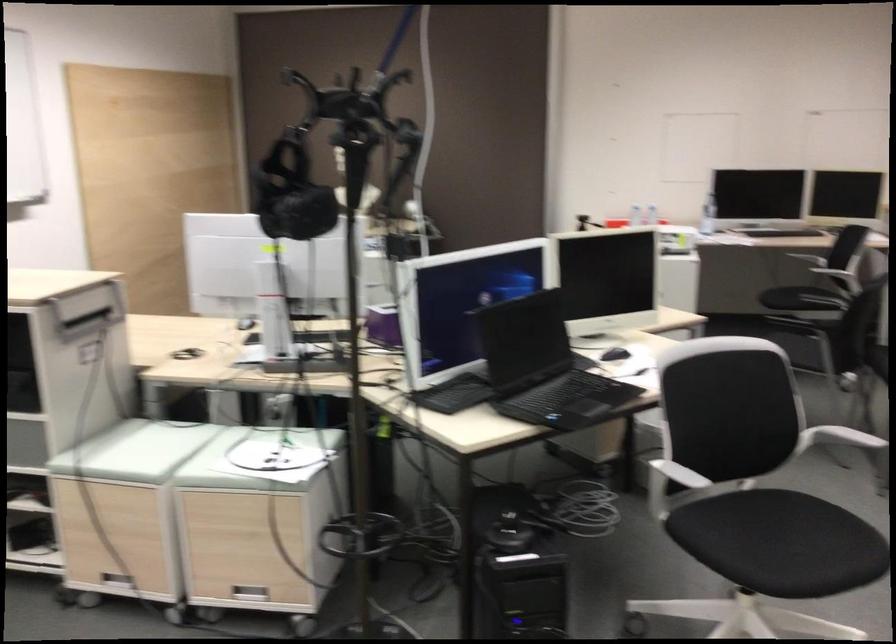
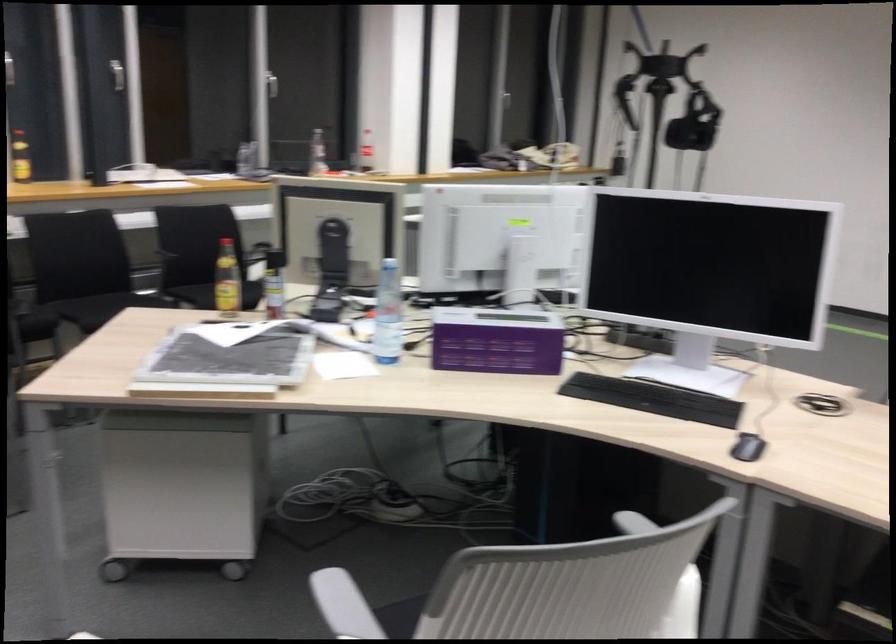
Question: I am providing you with two images of the same scene from different viewpoints. After the viewpoint changes to image2, which objects are now occluded?

Choices:
 (A) yellow-capped bottle
 (B) white panel handle
 (C) white chair armrest
 (D) silver window handle

Answer: (C)